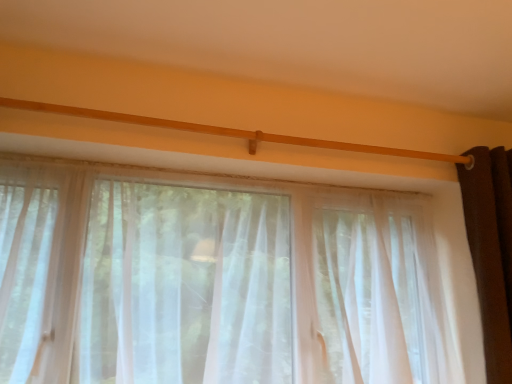
Question: From the image's perspective, is sheer white curtain at upper center, marked as the 2th curtain in a right-to-left arrangement, located above or below dark brown velvet curtain at right, which is the second curtain from left to right?

Choices:
 (A) below
 (B) above

Answer: (A)

Question: Is point [x=58, y=183] positioned closer to the camera than point [x=495, y=233]?

Choices:
 (A) farther
 (B) closer

Answer: (B)

Question: Would you say sheer white curtain at upper center, which is the first curtain in left-to-right order, is inside or outside dark brown velvet curtain at right, the first curtain when ordered from right to left?

Choices:
 (A) outside
 (B) inside

Answer: (A)

Question: Would you say dark brown velvet curtain at right, which is the second curtain from left to right, is inside or outside sheer white curtain at upper center, marked as the 2th curtain in a right-to-left arrangement?

Choices:
 (A) inside
 (B) outside

Answer: (B)

Question: Looking at their shapes, would you say dark brown velvet curtain at right, the first curtain when ordered from right to left, is wider or thinner than sheer white curtain at upper center, which is the first curtain in left-to-right order?

Choices:
 (A) wide
 (B) thin

Answer: (B)

Question: Is dark brown velvet curtain at right, the first curtain when ordered from right to left, to the left or to the right of sheer white curtain at upper center, which is the first curtain in left-to-right order, in the image?

Choices:
 (A) right
 (B) left

Answer: (A)

Question: Considering the positions of dark brown velvet curtain at right, the first curtain when ordered from right to left, and sheer white curtain at upper center, which is the first curtain in left-to-right order, in the image, is dark brown velvet curtain at right, the first curtain when ordered from right to left, bigger or smaller than sheer white curtain at upper center, which is the first curtain in left-to-right order,?

Choices:
 (A) small
 (B) big

Answer: (A)